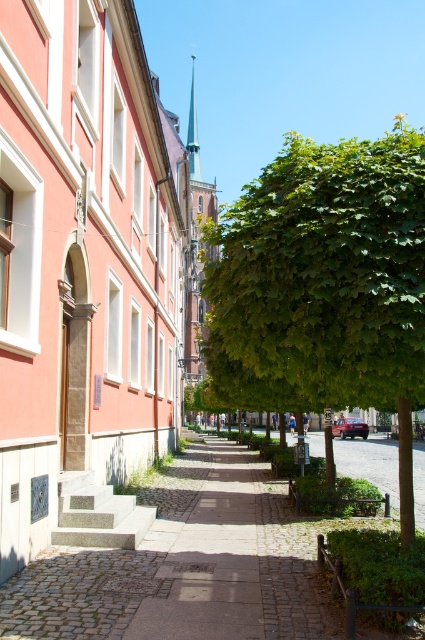
In the scene shown: You are a tourist standing on the cobblestone sidewalk at center and want to take a photo of the green leafy tree at center. Since you have a wide angle lens, will the tree fill most of the frame?

The green leafy tree at center is larger in size than cobblestone sidewalk at center, so yes, the tree will fill most of the frame when using a wide angle lens.

You are a tourist standing on the cobblestone sidewalk at center in the middle of the street. You want to take a photo of the green leafy tree at center. Which direction should you turn to face the tree?

The green leafy tree at center is to the right of the cobblestone sidewalk at center, so you should turn to your right to face the tree.